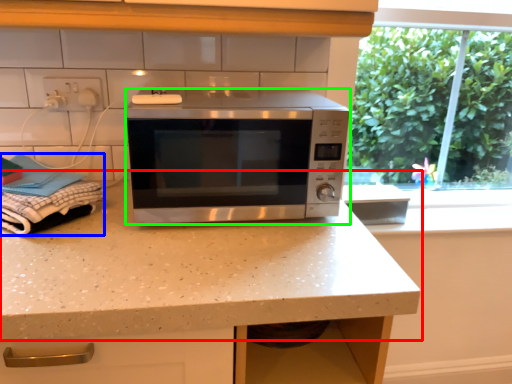
Question: Which object is the closest to the countertop (highlighted by a red box)? Choose among these: laundry (highlighted by a blue box) or microwave oven (highlighted by a green box).

Choices:
 (A) laundry
 (B) microwave oven

Answer: (B)